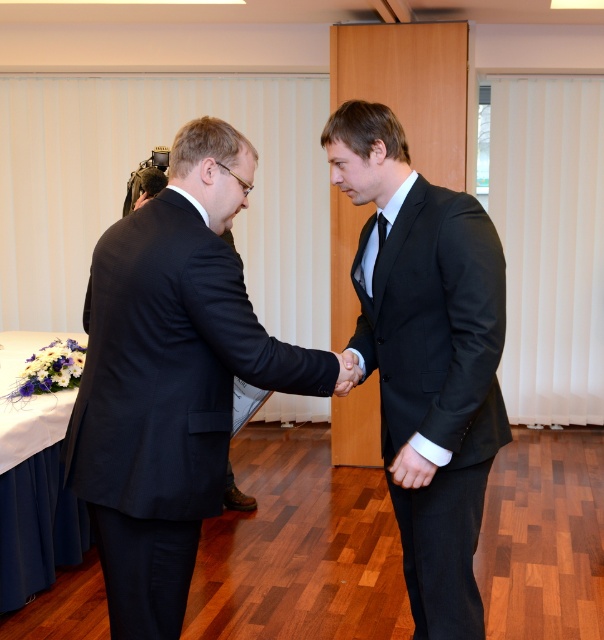
You are standing in the room where the two men are shaking hands. You need to place a small decorative pin exactly at the point labeled point (426, 356). According to the scene description, where should you place the pin?

The point (426, 356) is on the black satin suit at center, so you should place the pin on the black satin suit at center.